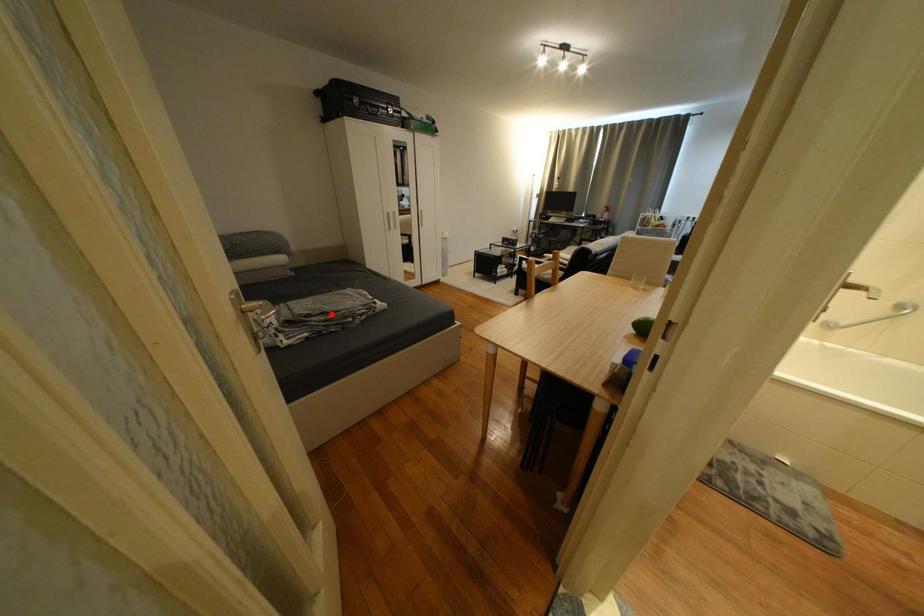
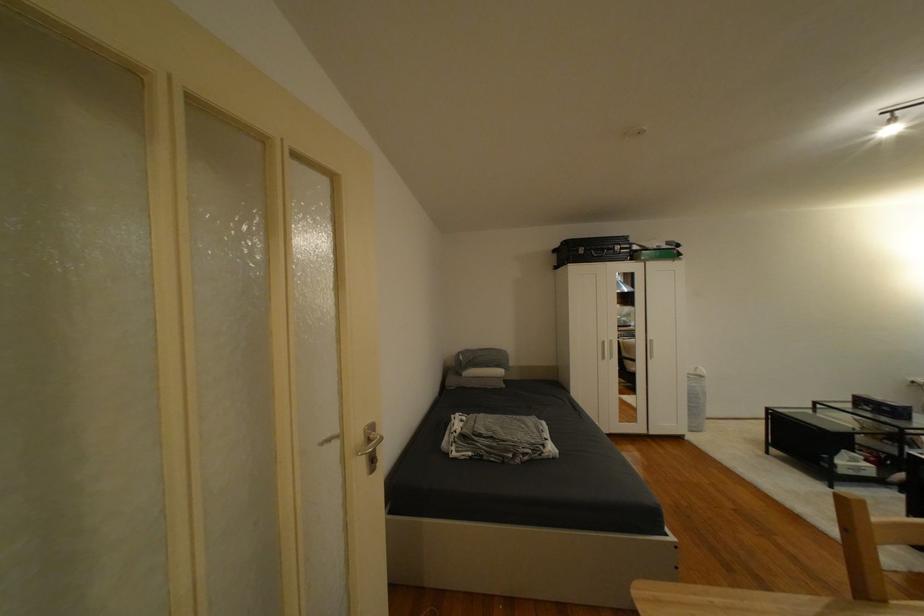
In the second image, find the point that corresponds to the highlighted location in the first image.

(500, 439)